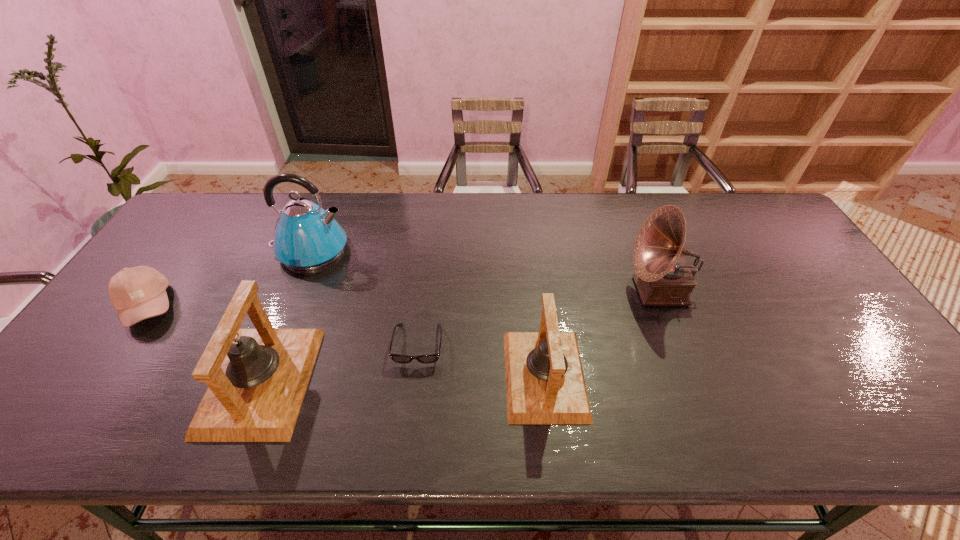
Locate an element on the screen. The height and width of the screenshot is (540, 960). vacant area between the kettle and the phonograph record is located at coordinates (485, 271).

You are a GUI agent. You are given a task and a screenshot of the screen. Output one action in this format:
    pyautogui.click(x=<x>, y=<y>)
    Task: Click on the free point between the third tallest object and the spectacles
    This screenshot has height=540, width=960.
    Given the screenshot: What is the action you would take?
    pyautogui.click(x=340, y=363)

At what (x,y) coordinates should I click in order to perform the action: click on free space between the left bell and the spectacles. Please return your answer as a coordinate pair (x, y). The image size is (960, 540). Looking at the image, I should click on (340, 363).

Find the location of `free space between the kettle and the rightmost object`. free space between the kettle and the rightmost object is located at coordinates (485, 271).

Where is `blank region between the kettle and the baseball cap`? The height and width of the screenshot is (540, 960). blank region between the kettle and the baseball cap is located at coordinates (229, 278).

Locate an element on the screen. free space between the fourth object from left to right and the rightmost object is located at coordinates (539, 318).

I want to click on vacant space in between the shortest object and the fourth tallest object, so coord(482,360).

Find the location of a particular element. vacant area between the phonograph record and the shortest object is located at coordinates (539, 318).

Select which object appears as the closest to the fourth object from left to right. Please provide its 2D coordinates. Your answer should be formatted as a tuple, i.e. [(x, y)], where the tuple contains the x and y coordinates of a point satisfying the conditions above.

[(545, 384)]

You are a GUI agent. You are given a task and a screenshot of the screen. Output one action in this format:
    pyautogui.click(x=<x>, y=<y>)
    Task: Click on the object identified as the fifth closest to the phonograph record
    This screenshot has width=960, height=540.
    Given the screenshot: What is the action you would take?
    pyautogui.click(x=137, y=293)